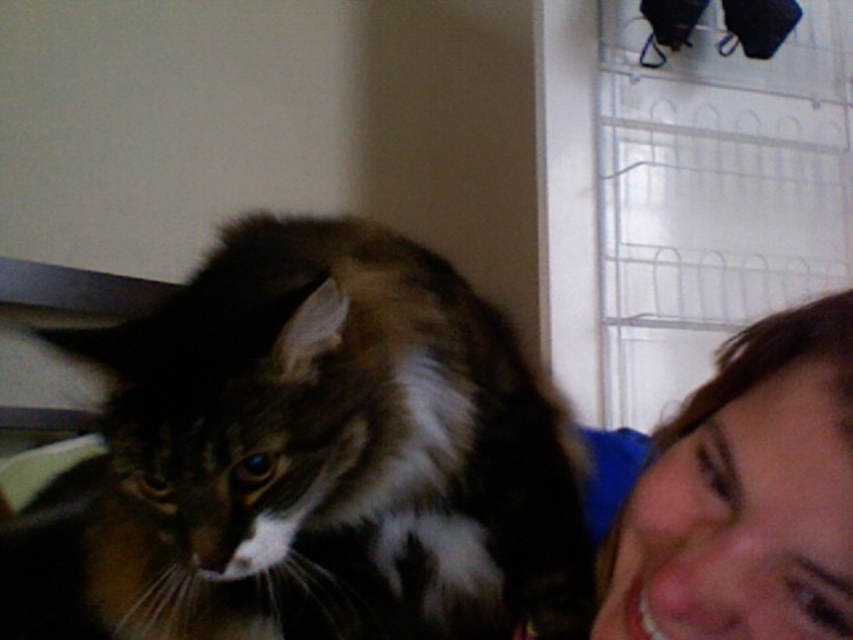
Question: Can you confirm if fuzzy brown cat at left is positioned above smooth skin face at lower right?

Choices:
 (A) yes
 (B) no

Answer: (A)

Question: Is fuzzy brown cat at left in front of smooth skin face at lower right?

Choices:
 (A) yes
 (B) no

Answer: (B)

Question: Can you confirm if fuzzy brown cat at left is positioned above smooth skin face at lower right?

Choices:
 (A) no
 (B) yes

Answer: (B)

Question: Which point is farther from the camera taking this photo?

Choices:
 (A) (761, 358)
 (B) (440, 259)

Answer: (B)